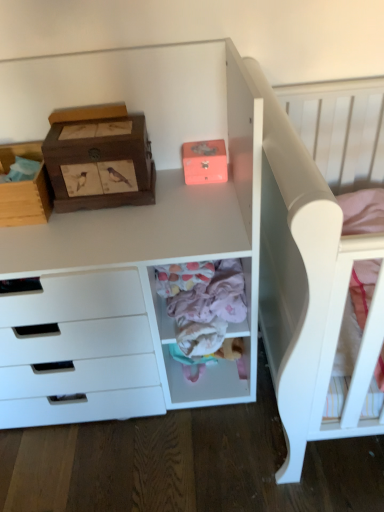
Question: Does point (160, 232) appear closer or farther from the camera than point (223, 369)?

Choices:
 (A) closer
 (B) farther

Answer: (A)

Question: Would you say white matte wooden desk at upper left is inside or outside pastel pink fabric at center?

Choices:
 (A) inside
 (B) outside

Answer: (B)

Question: Which object is the closest to the white matte wooden desk at upper left?

Choices:
 (A) woodenmaterial/textureshoe box at upper left, which appears as the 2th shoe box when viewed from the right
 (B) matte pink shoe box at upper center, the first shoe box when ordered from right to left
 (C) pastel pink fabric at lower center
 (D) wooden cardboard box at left
 (E) white matte bed at upper right

Answer: (C)

Question: Estimate the real-world distances between objects in this image. Which object is closer to the matte pink shoe box at upper center, the first shoe box when ordered from right to left?

Choices:
 (A) pastel pink fabric at lower center
 (B) white matte wooden desk at upper left
 (C) wooden cardboard box at left
 (D) white matte bed at upper right
 (E) woodenmaterial/textureshoe box at upper left, which appears as the 2th shoe box when viewed from the right

Answer: (E)